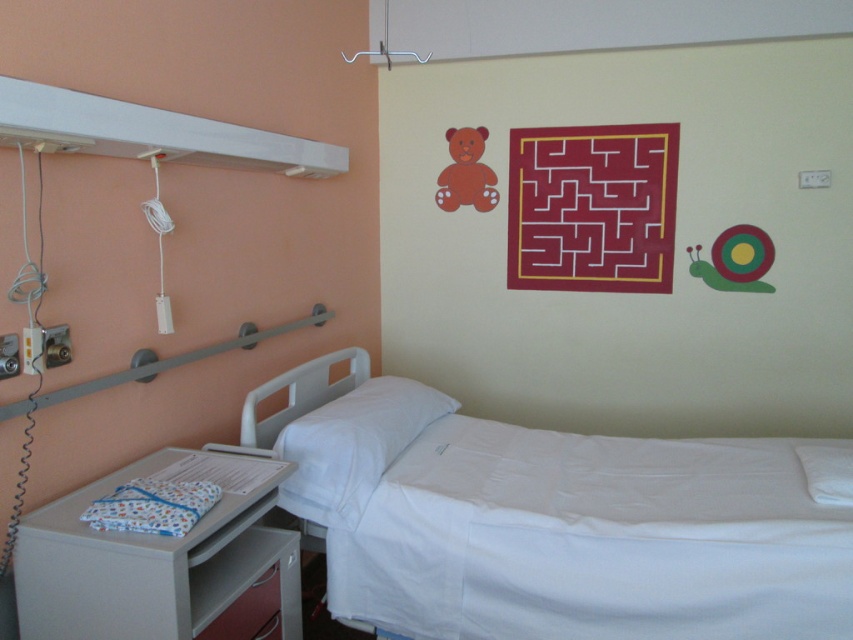
You are a nurse entering the hospital room and need to place a patient on the bed. From your current position at the entrance, which side of the white smooth bed at center would you approach from, given the position of the white plastic tray at lower left?

Since the white smooth bed at center is to the right of the white plastic tray at lower left, you would approach the bed from the left side as the tray is positioned to the bed.

You are a nurse in the hospital room and need to determine the distance between two points marked on the wall for installing safety equipment. The points are labeled as point (730,628) and point (115,557). Based on their positions, which point is closer to the viewer?

Point (115,557) is closer to the viewer than point (730,628) because the description states that point (730,628) is further away.

You are a nurse in a children hospital room. You need to place a new medical tray that is 1 meter wide. The white plastic tray at lower left is currently occupying space. Can the white smooth bed at center accommodate the new tray if it is moved there?

The white smooth bed at center might be wider than white plastic tray at lower left, so it is possible that the bed is wide enough to accommodate the new tray. However, without exact measurements, it is uncertain. Please verify the bed dimensions before moving the tray.